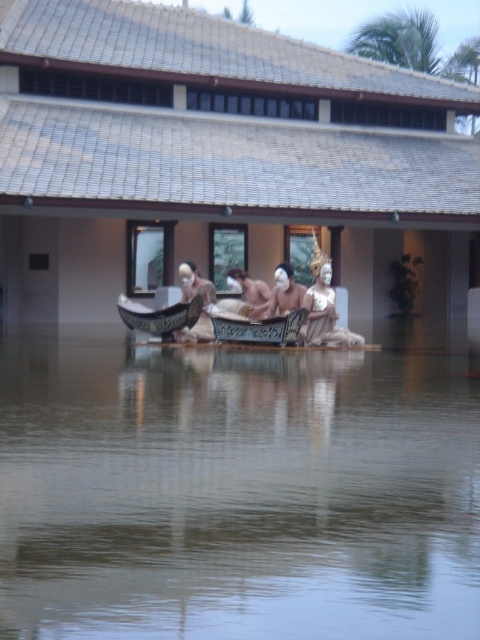
Based on the scene description, if you were standing on the boat looking towards the building, which object would you see first between the clear water at center and the matte white statue at center?

The matte white statue at center would be seen first because it is positioned above the clear water at center, which is located below it.

Looking at this image, you are a photographer taking a picture of the scene described. You want to ensure the matte white mask at center is perfectly centered in your shot. Given its current position at coordinates, can you adjust your camera to center it without moving the boat or the mask?

The matte white mask at center is already positioned at coordinates that are nearly centered in the frame, so minor adjustments to the camera angle should suffice to center it perfectly.